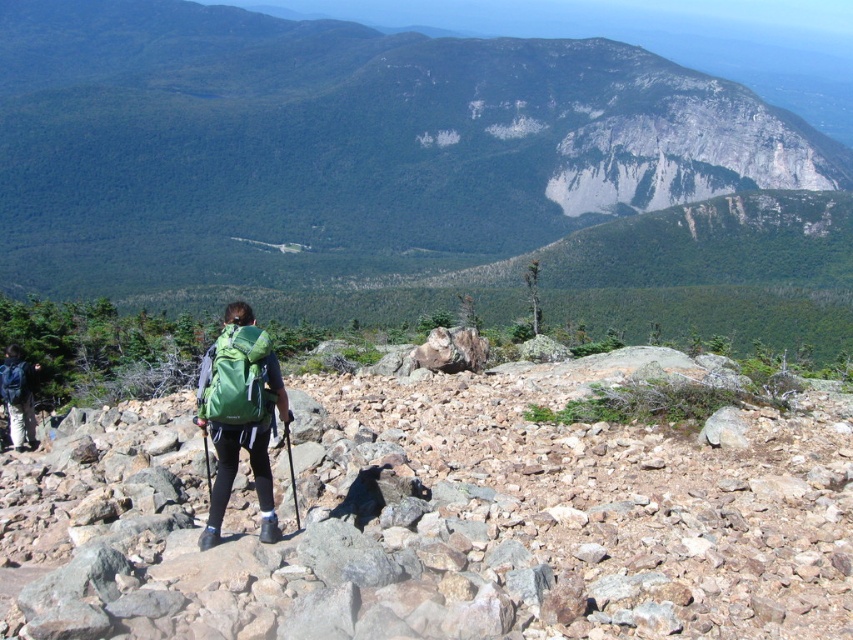
Question: Which point appears closest to the camera in this image?

Choices:
 (A) (410, 248)
 (B) (280, 394)

Answer: (B)

Question: Which object is farther from the camera taking this photo?

Choices:
 (A) green fabric backpack at center
 (B) rusty stone boulder at center

Answer: (A)

Question: Can you confirm if green rock at center is positioned to the right of rusty stone boulder at center?

Choices:
 (A) no
 (B) yes

Answer: (A)

Question: Can you confirm if rusty stone boulder at center is bigger than dark blue backpack at lower left?

Choices:
 (A) no
 (B) yes

Answer: (B)

Question: Can you confirm if green fabric backpack at center is positioned to the right of dark blue backpack at lower left?

Choices:
 (A) no
 (B) yes

Answer: (B)

Question: Which point is farther from the camera taking this photo?

Choices:
 (A) (337, 209)
 (B) (26, 440)
 (C) (202, 541)

Answer: (A)